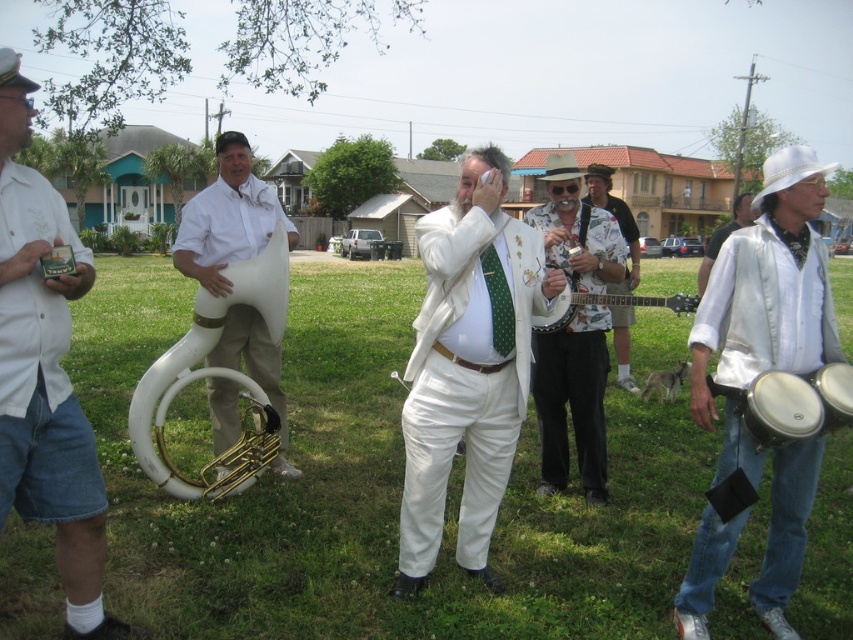
Question: Does green grass at center appear on the right side of white matte tuba at left?

Choices:
 (A) no
 (B) yes

Answer: (B)

Question: Which of these objects is positioned farthest from the printed fabric guitar at center?

Choices:
 (A) wooden banjo at center
 (B) white leather bongo at right

Answer: (B)

Question: Observing the image, what is the correct spatial positioning of floral print shirt at center in reference to wooden banjo at center?

Choices:
 (A) left
 (B) right

Answer: (A)

Question: Which point is farther to the camera?

Choices:
 (A) wooden banjo at center
 (B) white matte suit at center

Answer: (A)

Question: Estimate the real-world distances between objects in this image. Which object is closer to the white leather bongo at right?

Choices:
 (A) white cotton shorts at left
 (B) white leather hat at upper right
 (C) white matte suit at center
 (D) wooden banjo at center

Answer: (C)

Question: Can you confirm if white matte suit at center is positioned to the right of white matte tuba at left?

Choices:
 (A) no
 (B) yes

Answer: (B)